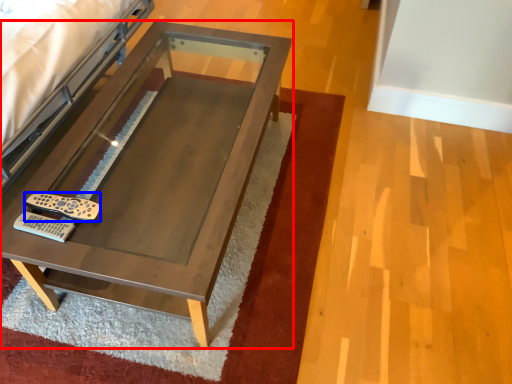
Question: Among these objects, which one is nearest to the camera, table (highlighted by a red box) or remote (highlighted by a blue box)?

Choices:
 (A) table
 (B) remote

Answer: (A)